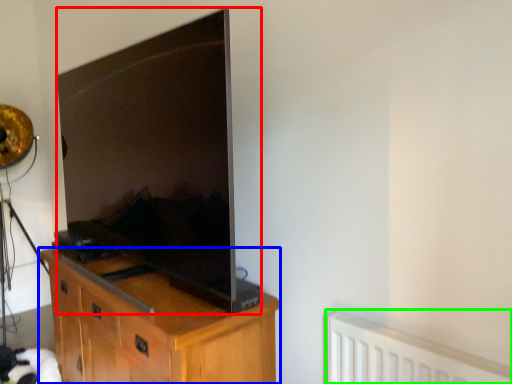
Question: Estimate the real-world distances between objects in this image. Which object is closer to television (highlighted by a red box), cabinetry (highlighted by a blue box) or radiator (highlighted by a green box)?

Choices:
 (A) cabinetry
 (B) radiator

Answer: (A)